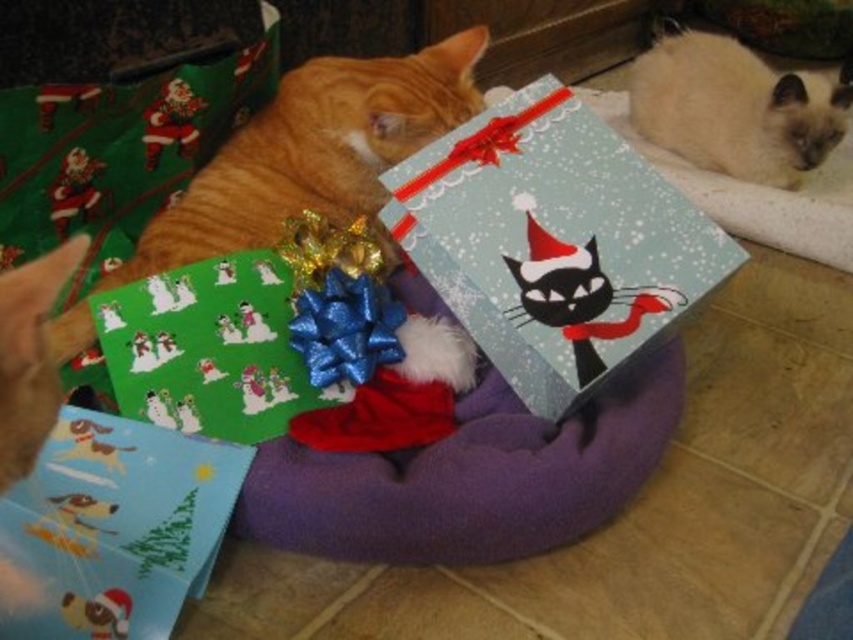
Is matte blue paper at center wider than matte paper gift at lower left?

Yes.

Does point (608, 176) come farther from viewer compared to point (100, 452)?

Yes.

Where is `matte blue paper at center`? The height and width of the screenshot is (640, 853). matte blue paper at center is located at coordinates (552, 241).

Who is lower down, matte paper gift at lower left or smokey white fur at upper right?

Positioned lower is matte paper gift at lower left.

Does point (155, 435) lie in front of point (634, 67)?

Yes, it is in front of point (634, 67).

Is point (213, 445) farther from viewer compared to point (682, 109)?

No, (213, 445) is in front of (682, 109).

At what (x,y) coordinates should I click in order to perform the action: click on matte paper gift at lower left. Please return your answer as a coordinate pair (x, y). Looking at the image, I should click on (117, 525).

Can you confirm if orange fur cat at upper left is smaller than smokey white fur at upper right?

No.

Between orange fur cat at upper left and smokey white fur at upper right, which one has less height?

With less height is smokey white fur at upper right.

Is point (453, 116) in front of point (730, 99)?

Yes, it is.

Locate an element on the screen. The width and height of the screenshot is (853, 640). orange fur cat at upper left is located at coordinates (312, 152).